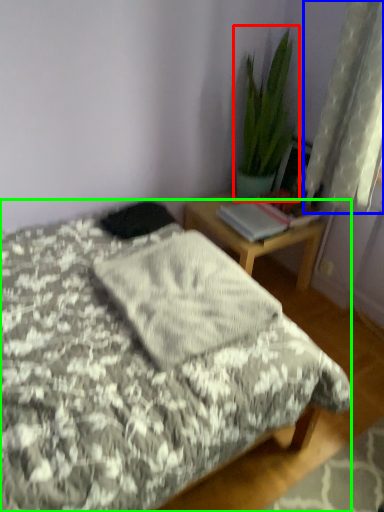
Question: Estimate the real-world distances between objects in this image. Which object is farther from houseplant (highlighted by a red box), curtain (highlighted by a blue box) or bed (highlighted by a green box)?

Choices:
 (A) curtain
 (B) bed

Answer: (B)